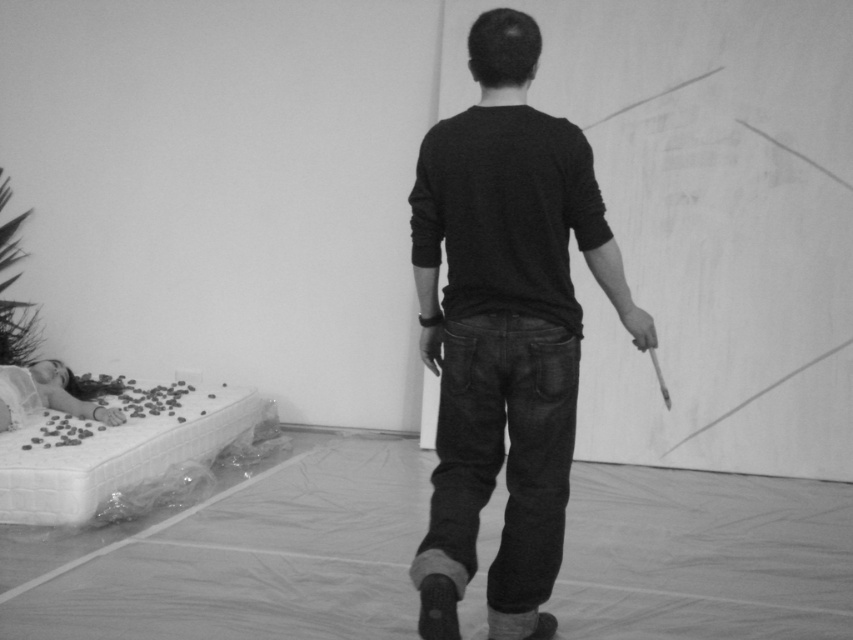
Can you confirm if black matte shirt at center is positioned above smooth white doll at lower left?

Yes, black matte shirt at center is above smooth white doll at lower left.

In order to click on black matte shirt at center in this screenshot , I will do `click(503, 328)`.

Identify the location of black matte shirt at center. Image resolution: width=853 pixels, height=640 pixels. pyautogui.click(x=503, y=328).